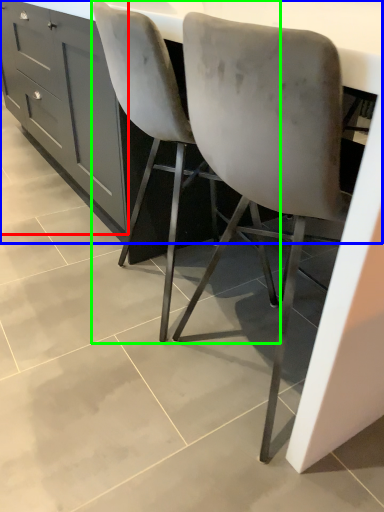
Question: Based on their relative distances, which object is nearer to cabinetry (highlighted by a red box)? Choose from counter (highlighted by a blue box) and chair (highlighted by a green box).

Choices:
 (A) counter
 (B) chair

Answer: (B)